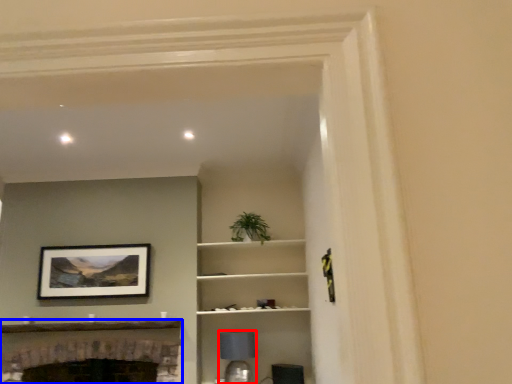
Question: Which point is further to the camera, lamp (highlighted by a red box) or fireplace (highlighted by a blue box)?

Choices:
 (A) lamp
 (B) fireplace

Answer: (A)